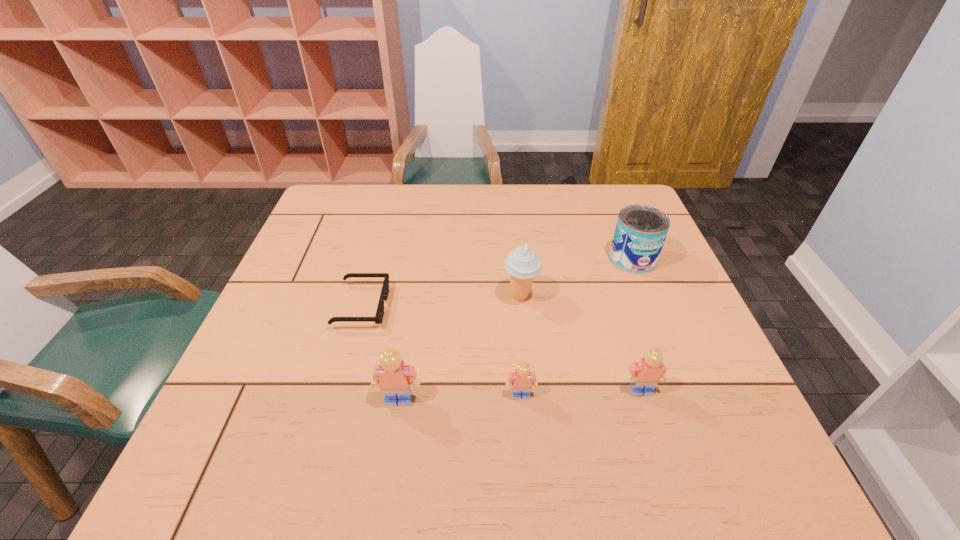
Where is `the tallest Lego`? the tallest Lego is located at coordinates (393, 376).

Locate an element on the screen. The height and width of the screenshot is (540, 960). the leftmost Lego is located at coordinates (393, 376).

This screenshot has height=540, width=960. Find the location of `the shortest Lego`. the shortest Lego is located at coordinates (522, 379).

At what (x,y) coordinates should I click in order to perform the action: click on the fifth tallest object. Please return your answer as a coordinate pair (x, y). Looking at the image, I should click on (522, 379).

Find the location of a particular element. This screenshot has width=960, height=540. the second shortest Lego is located at coordinates 646,374.

Locate an element on the screen. icecream is located at coordinates (522, 264).

At what (x,y) coordinates should I click in order to perform the action: click on the farthest object. Please return your answer as a coordinate pair (x, y). Looking at the image, I should click on (640, 232).

You are a GUI agent. You are given a task and a screenshot of the screen. Output one action in this format:
    pyautogui.click(x=<x>, y=<y>)
    Task: Click on the shortest object
    The image size is (960, 540).
    Given the screenshot: What is the action you would take?
    pyautogui.click(x=378, y=318)

This screenshot has width=960, height=540. What are the coordinates of `the leftmost object` in the screenshot? It's located at (378, 318).

Locate an element on the screen. blank space located 0.060m on the front-facing side of the rightmost Lego is located at coordinates (652, 424).